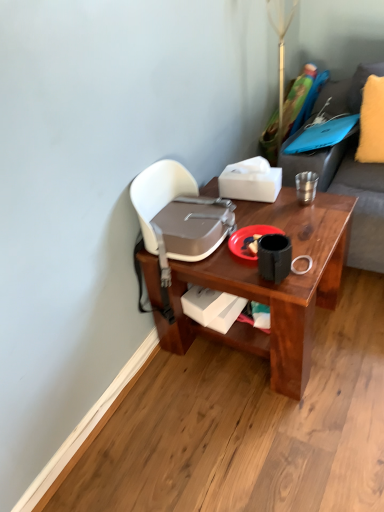
Describe the element at coordinates (212, 307) in the screenshot. The image size is (384, 512). I see `white matte box at lower center, the 1th box when ordered from bottom to top` at that location.

At what (x,y) coordinates should I click in order to perform the action: click on white matte box at lower center, the 1th box when ordered from bottom to top. Please return your answer as a coordinate pair (x, y). This screenshot has height=512, width=384. Looking at the image, I should click on (212, 307).

Find the location of `yellow fuzzy pillow at upper right`. yellow fuzzy pillow at upper right is located at coordinates (372, 122).

What do you see at coordinates (250, 180) in the screenshot?
I see `white matte tissue box at upper center, which ranks as the 2th box in bottom-to-top order` at bounding box center [250, 180].

I want to click on red matte plate at center, so 249,240.

What is the approximate height of red matte plate at center?

The height of red matte plate at center is 0.79 inches.

Locate an element on the screen. The image size is (384, 512). brown wood desk at center is located at coordinates (271, 286).

Locate an element on the screen. Image resolution: width=384 pixels, height=512 pixels. white matte box at lower center, the second box positioned from the top is located at coordinates (212, 307).

Considering the sizes of objects metallic pole at upper center and white matte box at lower center, the second box positioned from the top, in the image provided, who is taller, metallic pole at upper center or white matte box at lower center, the second box positioned from the top,?

metallic pole at upper center.

Which is more to the right, metallic pole at upper center or white matte box at lower center, the second box positioned from the top?

metallic pole at upper center.

In the scene shown: From a real-world perspective, which is physically below, metallic pole at upper center or white matte box at lower center, the second box positioned from the top?

white matte box at lower center, the second box positioned from the top, is physically lower.

From the image's perspective, which is below, metallic pole at upper center or white matte box at lower center, the 1th box when ordered from bottom to top?

white matte box at lower center, the 1th box when ordered from bottom to top, appears lower in the image.

From a real-world perspective, is white matte box at lower center, the second box positioned from the top, above or below yellow fuzzy pillow at upper right?

In terms of real-world spatial position, white matte box at lower center, the second box positioned from the top, is below yellow fuzzy pillow at upper right.

Does point (198, 314) come behind point (380, 123)?

No, it is in front of (380, 123).

Considering the sizes of white matte box at lower center, the 1th box when ordered from bottom to top, and yellow fuzzy pillow at upper right in the image, is white matte box at lower center, the 1th box when ordered from bottom to top, bigger or smaller than yellow fuzzy pillow at upper right?

Considering their sizes, white matte box at lower center, the 1th box when ordered from bottom to top, takes up less space than yellow fuzzy pillow at upper right.

Is white matte box at lower center, the second box positioned from the top, positioned far away from yellow fuzzy pillow at upper right?

white matte box at lower center, the second box positioned from the top, is positioned a significant distance from yellow fuzzy pillow at upper right.

How different are the orientations of metallic silver coffee cup at upper right and red matte plate at center in degrees?

The angle between the facing direction of metallic silver coffee cup at upper right and the facing direction of red matte plate at center is 1.31 degrees.

Does metallic silver coffee cup at upper right appear on the right side of red matte plate at center?

Correct, you'll find metallic silver coffee cup at upper right to the right of red matte plate at center.

Considering the relative sizes of metallic silver coffee cup at upper right and red matte plate at center in the image provided, is metallic silver coffee cup at upper right thinner than red matte plate at center?

Yes.

Consider the image. Are metallic silver coffee cup at upper right and white matte box at lower center, the 1th box when ordered from bottom to top, far apart?

No, metallic silver coffee cup at upper right is not far from white matte box at lower center, the 1th box when ordered from bottom to top.

Which object is more forward, metallic silver coffee cup at upper right or white matte box at lower center, the 1th box when ordered from bottom to top?

white matte box at lower center, the 1th box when ordered from bottom to top.

Considering the relative sizes of metallic silver coffee cup at upper right and white matte box at lower center, the 1th box when ordered from bottom to top, in the image provided, is metallic silver coffee cup at upper right smaller than white matte box at lower center, the 1th box when ordered from bottom to top,?

Correct, metallic silver coffee cup at upper right occupies less space than white matte box at lower center, the 1th box when ordered from bottom to top.

Would you say metallic silver coffee cup at upper right is to the left or to the right of white matte box at lower center, the second box positioned from the top, in the picture?

metallic silver coffee cup at upper right is positioned on white matte box at lower center, the second box positioned from the top,'s right side.

Considering the sizes of metallic pole at upper center and white matte tissue box at upper center, positioned as the 1th box in top-to-bottom order, in the image, is metallic pole at upper center bigger or smaller than white matte tissue box at upper center, positioned as the 1th box in top-to-bottom order,?

In the image, metallic pole at upper center appears to be larger than white matte tissue box at upper center, positioned as the 1th box in top-to-bottom order.

Between metallic pole at upper center and white matte tissue box at upper center, which ranks as the 2th box in bottom-to-top order, which one appears on the left side from the viewer's perspective?

Positioned to the left is white matte tissue box at upper center, which ranks as the 2th box in bottom-to-top order.

Is metallic pole at upper center not near white matte tissue box at upper center, positioned as the 1th box in top-to-bottom order?

No, there isn't a large distance between metallic pole at upper center and white matte tissue box at upper center, positioned as the 1th box in top-to-bottom order.

Based on the photo, is metallic pole at upper center behind white matte tissue box at upper center, which ranks as the 2th box in bottom-to-top order?

Yes, the depth of metallic pole at upper center is greater than that of white matte tissue box at upper center, which ranks as the 2th box in bottom-to-top order.

Who is bigger, red matte plate at center or white matte box at lower center, the second box positioned from the top?

With larger size is white matte box at lower center, the second box positioned from the top.

Is point (234, 236) closer or farther from the camera than point (194, 320)?

Point (234, 236).

Is red matte plate at center turned away from white matte box at lower center, the 1th box when ordered from bottom to top?

No, white matte box at lower center, the 1th box when ordered from bottom to top, is not at the back of red matte plate at center.

How distant is white matte box at lower center, the second box positioned from the top, from metallic pole at upper center?

white matte box at lower center, the second box positioned from the top, is 1.15 meters from metallic pole at upper center.

Considering the sizes of objects white matte box at lower center, the 1th box when ordered from bottom to top, and metallic pole at upper center in the image provided, who is bigger, white matte box at lower center, the 1th box when ordered from bottom to top, or metallic pole at upper center?

metallic pole at upper center is bigger.

Considering the positions of point (195, 304) and point (269, 2), is point (195, 304) closer or farther from the camera than point (269, 2)?

Point (195, 304) appears to be closer to the viewer than point (269, 2).

Identify the location of table lamp positioned vertically above the white matte box at lower center, the second box positioned from the top (from a real-world perspective). This screenshot has width=384, height=512. (281, 45).

Locate an element on the screen. This screenshot has width=384, height=512. the 2nd box located beneath the yellow fuzzy pillow at upper right (from a real-world perspective) is located at coordinates (212, 307).

Based on their spatial positions, is white matte tissue box at upper center, which ranks as the 2th box in bottom-to-top order, or metallic pole at upper center closer to white matte box at lower center, the second box positioned from the top?

white matte tissue box at upper center, which ranks as the 2th box in bottom-to-top order.

Estimate the real-world distances between objects in this image. Which object is closer to metallic silver coffee cup at upper right, white matte tissue box at upper center, positioned as the 1th box in top-to-bottom order, or yellow fuzzy pillow at upper right?

white matte tissue box at upper center, positioned as the 1th box in top-to-bottom order, is closer to metallic silver coffee cup at upper right.

From the picture: Based on their spatial positions, is yellow fuzzy pillow at upper right or metallic pole at upper center closer to metallic silver coffee cup at upper right?

yellow fuzzy pillow at upper right lies closer to metallic silver coffee cup at upper right than the other object.

Looking at this image, when comparing their distances from white matte box at lower center, the second box positioned from the top, does red matte plate at center or metallic silver coffee cup at upper right seem further?

metallic silver coffee cup at upper right is further to white matte box at lower center, the second box positioned from the top.

Estimate the real-world distances between objects in this image. Which object is closer to red matte plate at center, metallic pole at upper center or yellow fuzzy pillow at upper right?

Among the two, yellow fuzzy pillow at upper right is located nearer to red matte plate at center.

Considering their positions, is brown wood desk at center positioned closer to white matte box at lower center, the second box positioned from the top, than red matte plate at center?

Based on the image, brown wood desk at center appears to be nearer to white matte box at lower center, the second box positioned from the top.

Looking at the image, which one is located further to brown wood desk at center, white matte tissue box at upper center, which ranks as the 2th box in bottom-to-top order, or yellow fuzzy pillow at upper right?

Based on the image, yellow fuzzy pillow at upper right appears to be further to brown wood desk at center.

When comparing their distances from yellow fuzzy pillow at upper right, does brown wood desk at center or red matte plate at center seem further?

red matte plate at center is further to yellow fuzzy pillow at upper right.

You are a GUI agent. You are given a task and a screenshot of the screen. Output one action in this format:
    pyautogui.click(x=<x>, y=<y>)
    Task: Click on the box between yellow fuzzy pillow at upper right and brown wood desk at center in the up-down direction
    This screenshot has width=384, height=512.
    Given the screenshot: What is the action you would take?
    pyautogui.click(x=250, y=180)

I want to click on box between metallic pole at upper center and white matte box at lower center, the second box positioned from the top, in the vertical direction, so click(250, 180).

Locate an element on the screen. plate between metallic silver coffee cup at upper right and brown wood desk at center in the vertical direction is located at coordinates (249, 240).

You are a GUI agent. You are given a task and a screenshot of the screen. Output one action in this format:
    pyautogui.click(x=<x>, y=<y>)
    Task: Click on the pillow between metallic pole at upper center and white matte box at lower center, the second box positioned from the top, vertically
    This screenshot has height=512, width=384.
    Given the screenshot: What is the action you would take?
    pyautogui.click(x=372, y=122)